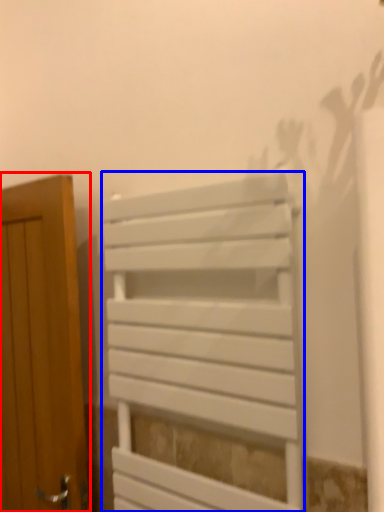
Question: Which object is further to the camera taking this photo, door (highlighted by a red box) or furniture (highlighted by a blue box)?

Choices:
 (A) door
 (B) furniture

Answer: (A)